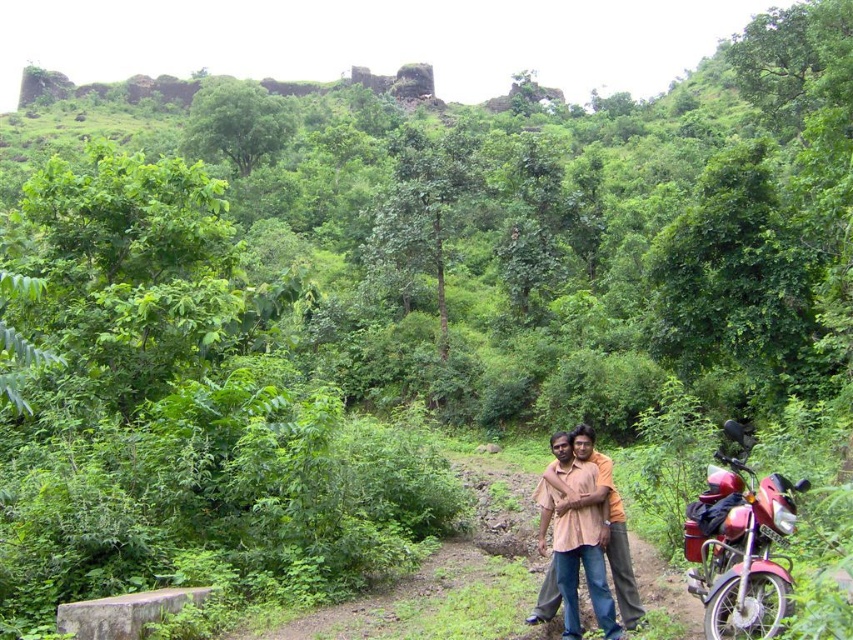
Question: Which object appears closest to the camera in this image?

Choices:
 (A) light brown cotton shirt at center
 (B) metallic red motorcycle at lower right

Answer: (B)

Question: Among these objects, which one is farthest from the camera?

Choices:
 (A) metallic red motorcycle at lower right
 (B) light brown cotton shirt at center

Answer: (B)

Question: Does metallic red motorcycle at lower right appear on the left side of light brown cotton shirt at center?

Choices:
 (A) yes
 (B) no

Answer: (A)

Question: Can you confirm if metallic red motorcycle at lower right is positioned to the right of light brown cotton shirt at center?

Choices:
 (A) no
 (B) yes

Answer: (A)

Question: Can you confirm if metallic red motorcycle at lower right is smaller than light brown cotton shirt at center?

Choices:
 (A) no
 (B) yes

Answer: (B)